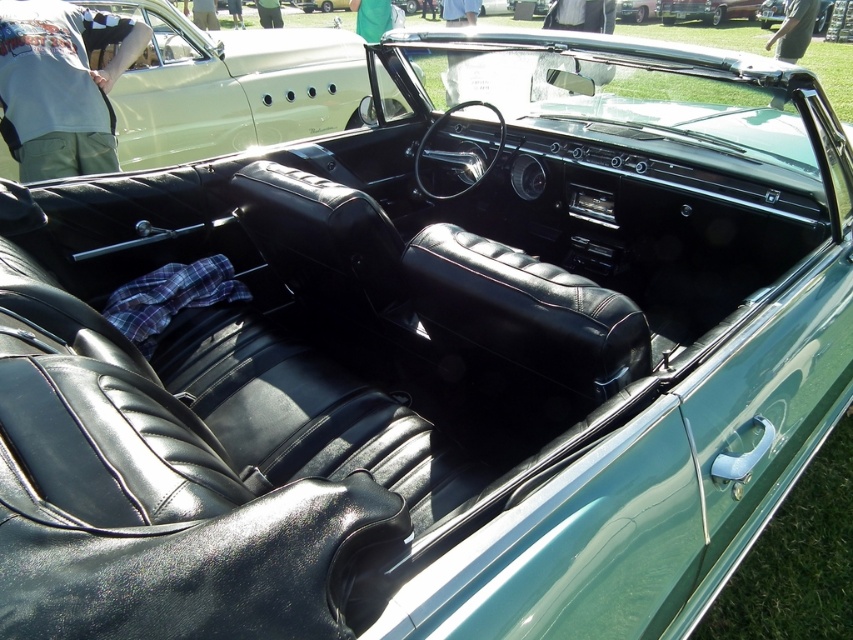
Question: Can you confirm if matte black leather seats at center is positioned above shiny silver car at upper center?

Choices:
 (A) yes
 (B) no

Answer: (B)

Question: Can you confirm if shiny silver car at upper center is positioned below green leather convertible at upper center?

Choices:
 (A) yes
 (B) no

Answer: (B)

Question: Which is nearer to the matte black leather seats at center?

Choices:
 (A) shiny silver car at upper center
 (B) green leather convertible at upper center

Answer: (B)

Question: Which of the following is the closest to the observer?

Choices:
 (A) matte black leather seats at center
 (B) shiny silver car at upper center

Answer: (A)

Question: Does shiny silver car at upper center have a greater width compared to green leather convertible at upper center?

Choices:
 (A) no
 (B) yes

Answer: (B)

Question: Which point appears farthest from the camera in this image?

Choices:
 (A) (242, 49)
 (B) (715, 0)
 (C) (769, 4)

Answer: (B)